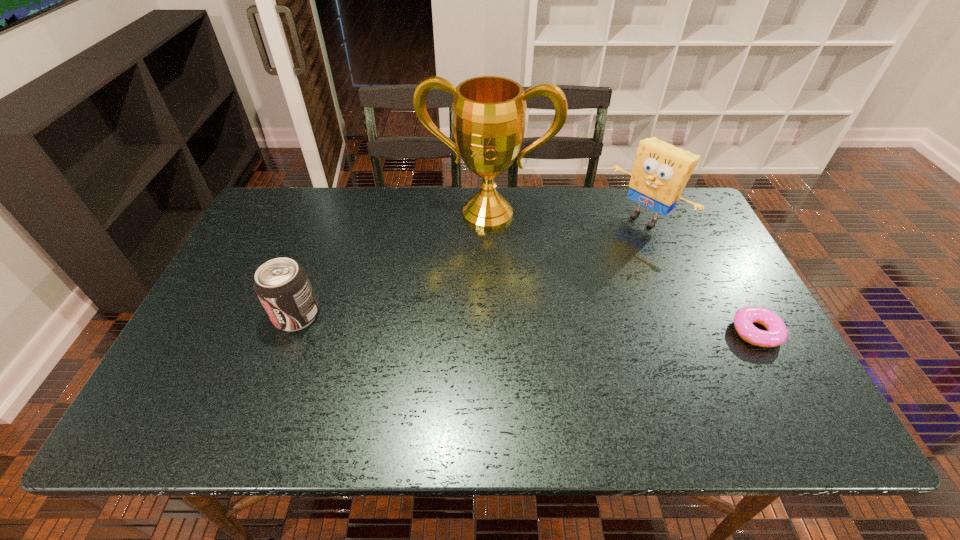
Where is `free region at the near edge of the desktop`? free region at the near edge of the desktop is located at coordinates (496, 371).

In the image, there is a desktop. Identify the location of vacant space at the left edge. (244, 262).

You are a GUI agent. You are given a task and a screenshot of the screen. Output one action in this format:
    pyautogui.click(x=<x>, y=<y>)
    Task: Click on the vacant area at the right edge of the desktop
    
    Given the screenshot: What is the action you would take?
    pyautogui.click(x=673, y=247)

In the image, there is a desktop. Find the location of `vacant area at the far right corner`. vacant area at the far right corner is located at coordinates (679, 200).

You are a GUI agent. You are given a task and a screenshot of the screen. Output one action in this format:
    pyautogui.click(x=<x>, y=<y>)
    Task: Click on the vacant space that is in between the soda can and the sponge
    This screenshot has width=960, height=540.
    Given the screenshot: What is the action you would take?
    pyautogui.click(x=470, y=267)

Locate an element on the screen. unoccupied position between the leftmost object and the third object from right to left is located at coordinates (392, 265).

I want to click on free space between the third shortest object and the soda can, so click(470, 267).

Where is `vacant space that's between the shortest object and the sponge`? The height and width of the screenshot is (540, 960). vacant space that's between the shortest object and the sponge is located at coordinates (701, 275).

Identify the location of free space between the second shortest object and the sponge. (470, 267).

You are a GUI agent. You are given a task and a screenshot of the screen. Output one action in this format:
    pyautogui.click(x=<x>, y=<y>)
    Task: Click on the vacant area between the doughnut and the third tallest object
    This screenshot has width=960, height=540.
    Given the screenshot: What is the action you would take?
    (x=526, y=323)